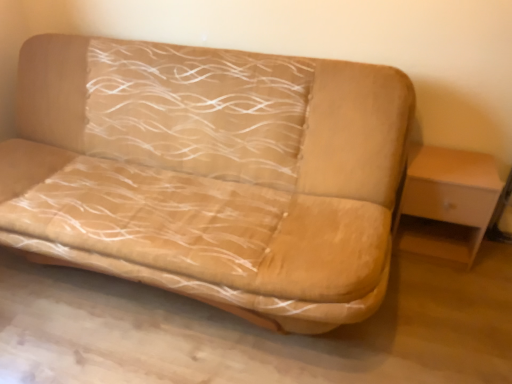
Image resolution: width=512 pixels, height=384 pixels. Find the location of `vacant area that lies between beige fabric couch at center and light wood/wooden table at right`. vacant area that lies between beige fabric couch at center and light wood/wooden table at right is located at coordinates (417, 305).